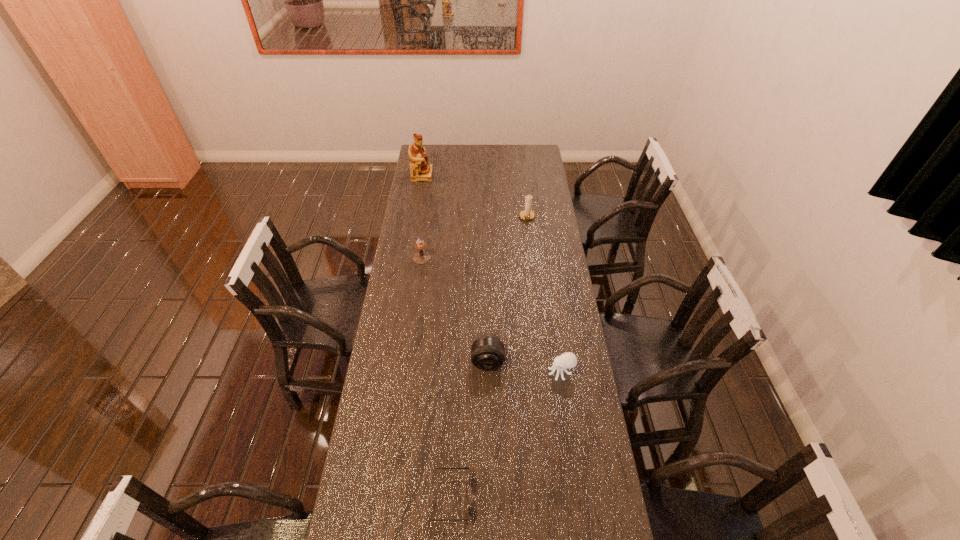
Find the location of a particular element. vacant area situated on the front-facing side of the farthest object is located at coordinates (456, 175).

Identify the location of free location located 0.310m on the handle side of the second farthest object. This screenshot has height=540, width=960. (534, 268).

Where is `free region located 0.050m on the left of the left candle holder`? Image resolution: width=960 pixels, height=540 pixels. free region located 0.050m on the left of the left candle holder is located at coordinates (401, 258).

I want to click on vacant position located 0.050m on the front-facing side of the telephoto lens, so click(488, 385).

Identify the location of free space located on the front-facing side of the second shortest object. This screenshot has width=960, height=540. (503, 372).

Locate an element on the screen. The width and height of the screenshot is (960, 540). free space located 0.050m on the front-facing side of the second shortest object is located at coordinates 534,372.

Find the location of a particular element. Image resolution: width=960 pixels, height=540 pixels. vacant region located 0.160m on the front-facing side of the second shortest object is located at coordinates (503, 372).

Locate an element on the screen. free space located on the front-facing side of the sunglasses is located at coordinates (566, 497).

Locate an element on the screen. figurine that is at the left edge is located at coordinates (421, 170).

Image resolution: width=960 pixels, height=540 pixels. I want to click on candle holder present at the left edge, so click(x=421, y=257).